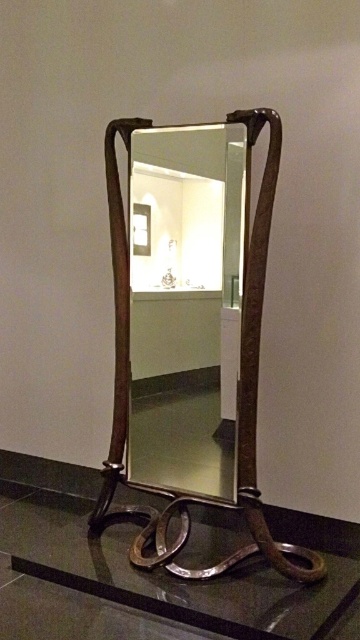
You are arranging furniture in a room and need to place the polished wood mirror at center and the transparent glass table at lower center. According to the scene, which object is positioned to the right side?

The polished wood mirror at center is positioned to the right of the transparent glass table at lower center, so the mirror is on the right side.

You are placing a small vase on the transparent glass table at lower center. If you want to see the reflection of the vase in the polished wood mirror at center, will you be able to? Please explain.

The polished wood mirror at center is above the transparent glass table at lower center. Since the mirror is positioned above the table, the reflection of the vase placed on the table would be visible in the mirror if the angle and lighting allow.

You are arranging furniture in a small living room. You have the polished wood mirror at center and the transparent glass table at lower center. Which object takes up more floor space?

The transparent glass table at lower center takes up more floor space because the polished wood mirror at center occupies less space than it.